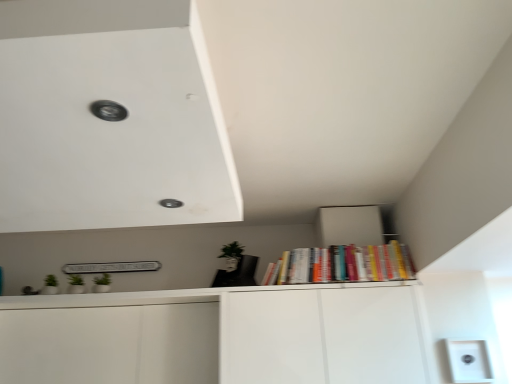
This screenshot has height=384, width=512. What are the coordinates of `hardcover books at upper right` in the screenshot? It's located at (342, 264).

What do you see at coordinates (342, 264) in the screenshot? I see `hardcover books at upper right` at bounding box center [342, 264].

Measure the distance between point (x=460, y=354) and camera.

They are 8.53 feet apart.

This screenshot has height=384, width=512. What do you see at coordinates (469, 361) in the screenshot? I see `white plastic light switch at lower right` at bounding box center [469, 361].

Locate an element on the screen. The image size is (512, 384). white plastic light switch at lower right is located at coordinates (469, 361).

Locate an element on the screen. This screenshot has width=512, height=384. hardcover books at upper right is located at coordinates (342, 264).

Is hardcover books at upper right at the right side of white plastic light switch at lower right?

Incorrect, hardcover books at upper right is not on the right side of white plastic light switch at lower right.

Considering their positions, is hardcover books at upper right located in front of or behind white plastic light switch at lower right?

In the image, hardcover books at upper right appears behind white plastic light switch at lower right.

Which is behind, point (348, 280) or point (458, 346)?

Point (348, 280)

From the image's perspective, is hardcover books at upper right located above or below white plastic light switch at lower right?

hardcover books at upper right is situated higher than white plastic light switch at lower right in the image.

From a real-world perspective, which object stands above the other?

hardcover books at upper right, from a real-world perspective.

Which of these two, hardcover books at upper right or white plastic light switch at lower right, is thinner?

With smaller width is white plastic light switch at lower right.

Who is shorter, hardcover books at upper right or white plastic light switch at lower right?

Standing shorter between the two is white plastic light switch at lower right.

Which of these two, hardcover books at upper right or white plastic light switch at lower right, is smaller?

white plastic light switch at lower right.

Based on the photo, is hardcover books at upper right spatially inside white plastic light switch at lower right, or outside of it?

hardcover books at upper right is spatially situated outside white plastic light switch at lower right.

Consider the image. Is hardcover books at upper right next to white plastic light switch at lower right?

No.

In the scene shown: Could you tell me if hardcover books at upper right is facing white plastic light switch at lower right?

No, hardcover books at upper right is not facing towards white plastic light switch at lower right.

What's the angular difference between hardcover books at upper right and white plastic light switch at lower right's facing directions?

hardcover books at upper right and white plastic light switch at lower right are facing 1.17 degrees away from each other.

Locate an element on the screen. book that is above the white plastic light switch at lower right (from a real-world perspective) is located at coordinates (342, 264).

Between white plastic light switch at lower right and hardcover books at upper right, which one appears on the left side from the viewer's perspective?

Positioned to the left is hardcover books at upper right.

Which object is further away from the camera, white plastic light switch at lower right or hardcover books at upper right?

hardcover books at upper right is more distant.

Considering the positions of points (451, 349) and (287, 278), is point (451, 349) closer to camera compared to point (287, 278)?

Yes, point (451, 349) is in front of point (287, 278).

From the image's perspective, does white plastic light switch at lower right appear lower than hardcover books at upper right?

Yes, from the image's perspective, white plastic light switch at lower right is beneath hardcover books at upper right.

From a real-world perspective, which is physically below, white plastic light switch at lower right or hardcover books at upper right?

From a 3D spatial view, white plastic light switch at lower right is below.

Which of these two, white plastic light switch at lower right or hardcover books at upper right, is wider?

With larger width is hardcover books at upper right.

Based on the photo, from their relative heights in the image, would you say white plastic light switch at lower right is taller or shorter than hardcover books at upper right?

Considering their sizes, white plastic light switch at lower right has less height than hardcover books at upper right.

Can you confirm if white plastic light switch at lower right is bigger than hardcover books at upper right?

No, white plastic light switch at lower right is not bigger than hardcover books at upper right.

Is hardcover books at upper right inside white plastic light switch at lower right?

No, white plastic light switch at lower right does not contain hardcover books at upper right.

Is white plastic light switch at lower right far away from hardcover books at upper right?

Actually, white plastic light switch at lower right and hardcover books at upper right are a little close together.

Could you tell me if white plastic light switch at lower right is turned towards hardcover books at upper right?

No, white plastic light switch at lower right is not oriented towards hardcover books at upper right.

How far apart are white plastic light switch at lower right and hardcover books at upper right?

28.38 inches.

Find the location of a particular element. book that is above the white plastic light switch at lower right (from a real-world perspective) is located at coordinates (342, 264).

You are a GUI agent. You are given a task and a screenshot of the screen. Output one action in this format:
    pyautogui.click(x=<x>, y=<y>)
    Task: Click on the book above the white plastic light switch at lower right (from a real-world perspective)
    The height and width of the screenshot is (384, 512).
    Given the screenshot: What is the action you would take?
    pyautogui.click(x=342, y=264)

The image size is (512, 384). I want to click on light switch in front of the hardcover books at upper right, so click(x=469, y=361).